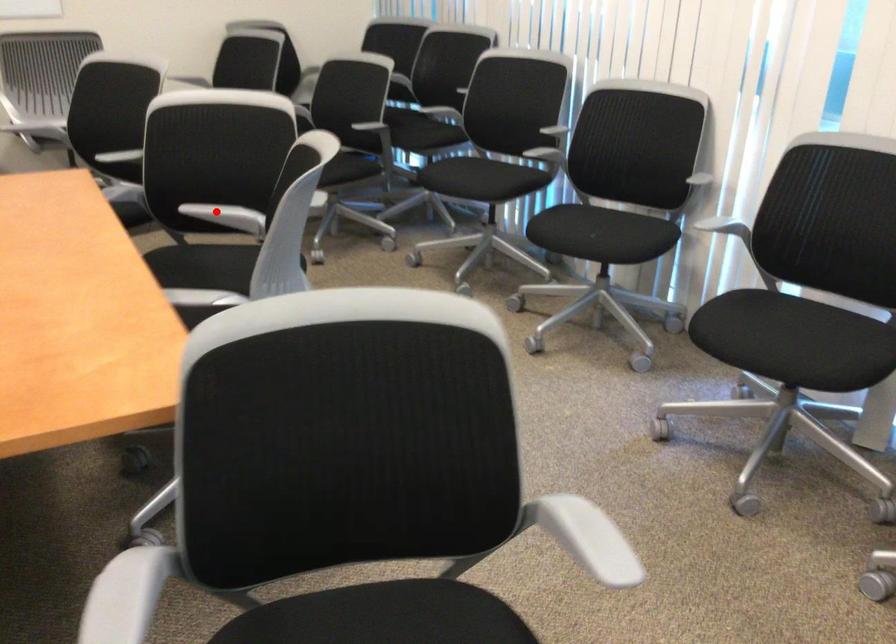
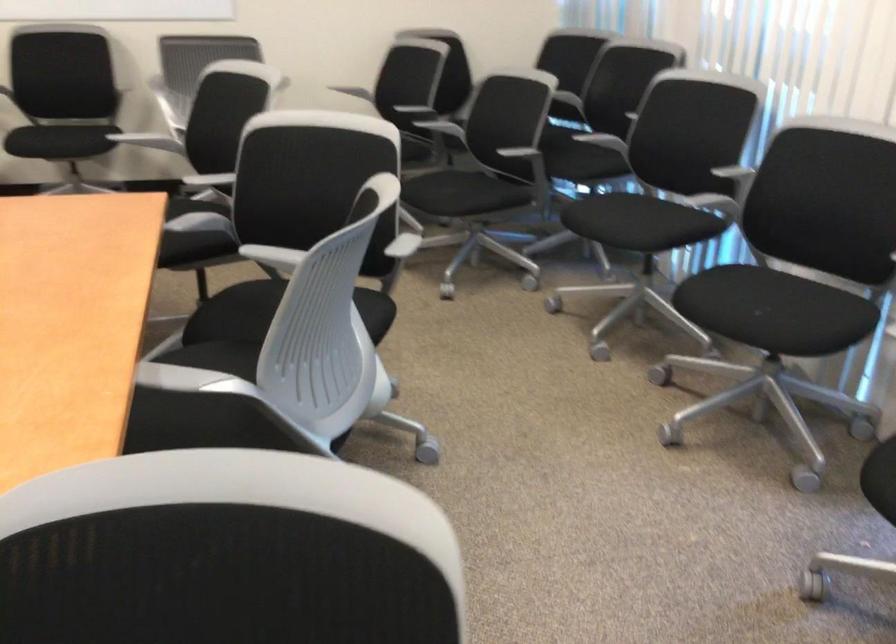
Question: I am providing you with two images of the same scene from different viewpoints. A red point is shown in image1. For the corresponding object point in image2, is it positioned nearer or farther from the camera?

Choices:
 (A) Nearer
 (B) Farther

Answer: (A)